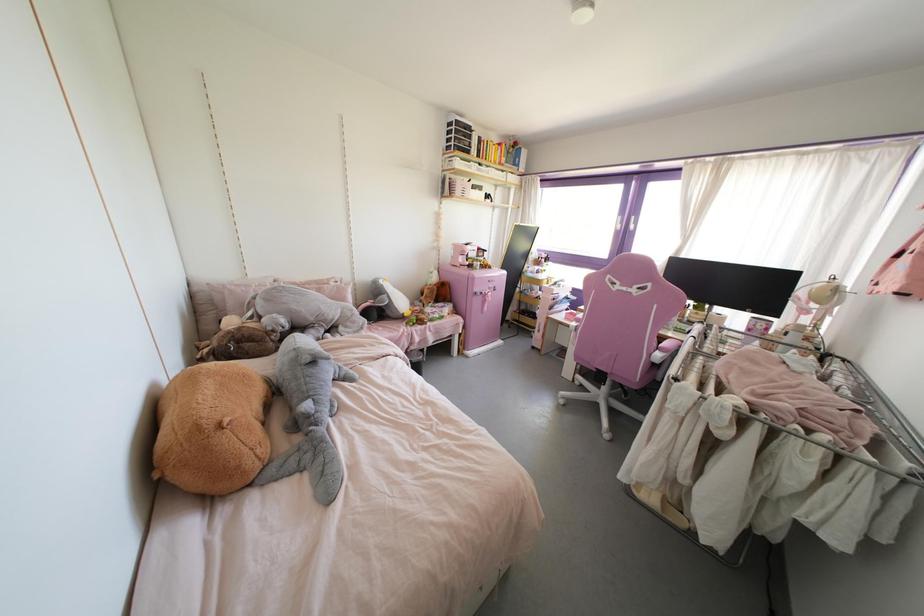
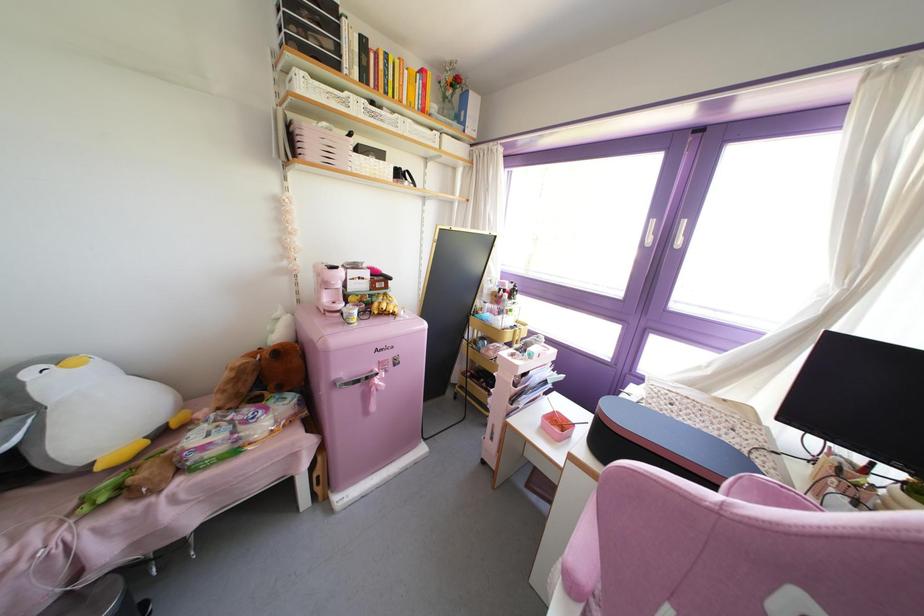
Find the pixel in the second image that matches [457,190] in the first image.

(310, 148)